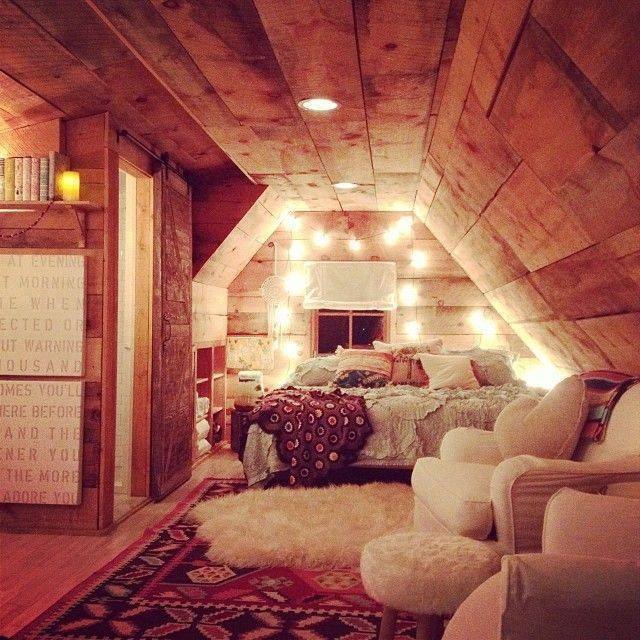
Identify the location of candle. (72, 182).